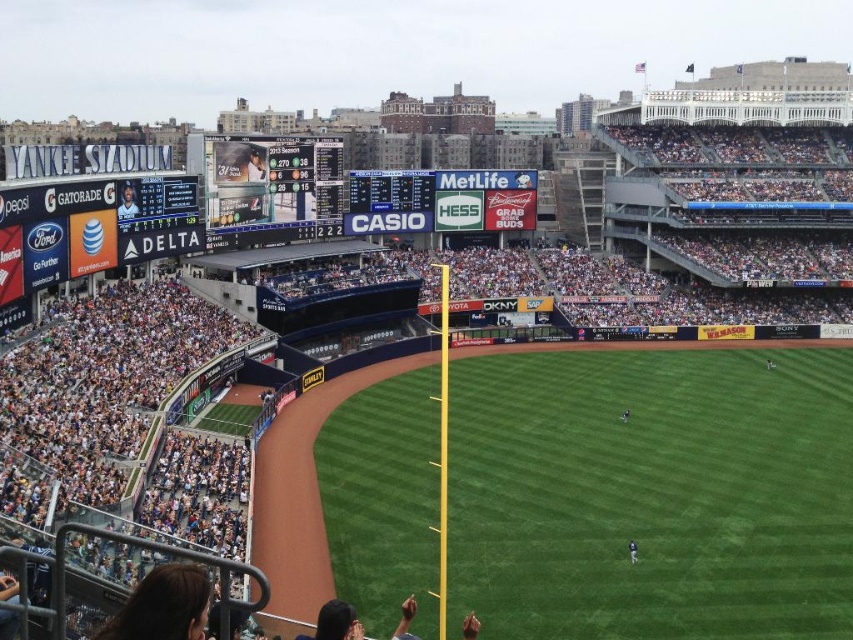
Question: Which point is farther to the camera?

Choices:
 (A) dark blue jersey at center
 (B) blue plastic scoreboard at center
 (C) matte digital scoreboard at upper center

Answer: (B)

Question: Which point is closer to the camera?

Choices:
 (A) matte digital scoreboard at upper center
 (B) blue plastic scoreboard at center
 (C) dark blue jersey at center
 (D) dark blue uniform at center

Answer: (C)

Question: Does blue plastic scoreboard at center appear on the right side of dark blue uniform at center?

Choices:
 (A) no
 (B) yes

Answer: (A)

Question: Which point is farther to the camera?

Choices:
 (A) (490, 627)
 (B) (131, 200)
 (C) (634, 545)

Answer: (B)

Question: Can you confirm if blue plastic scoreboard at center is bigger than dark blue uniform at center?

Choices:
 (A) no
 (B) yes

Answer: (B)

Question: Is matte black jersey at upper left closer to camera compared to dark green jersey at center?

Choices:
 (A) yes
 (B) no

Answer: (A)